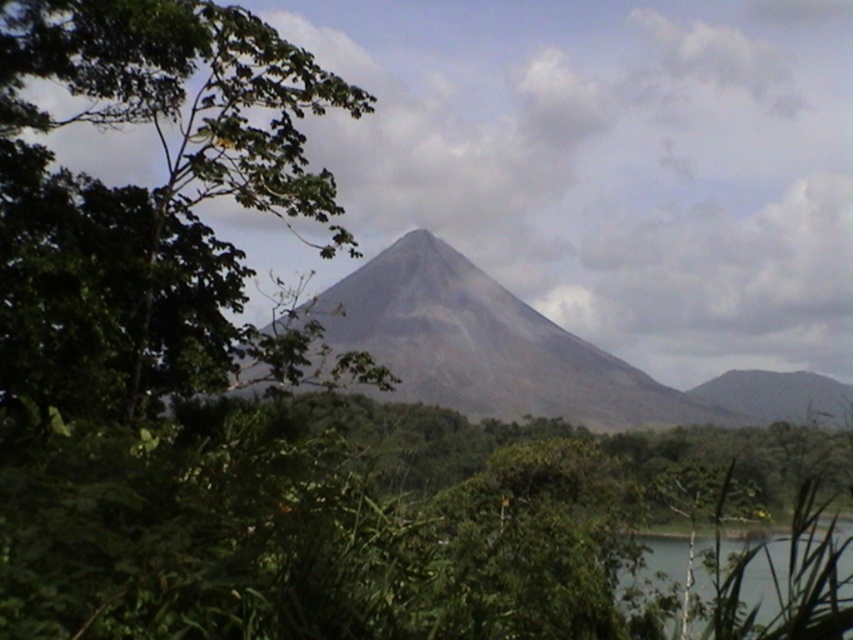
Question: Among these points, which one is farthest from the camera?

Choices:
 (A) (1, 156)
 (B) (683, 547)
 (C) (436, 248)

Answer: (C)

Question: Which object appears farthest from the camera in this image?

Choices:
 (A) gray volcanic rock mountain at center
 (B) transparent water at lower right

Answer: (A)

Question: Can you confirm if green leafy tree at center is positioned to the left of gray volcanic rock mountain at center?

Choices:
 (A) no
 (B) yes

Answer: (B)

Question: Is green leafy tree at center bigger than gray volcanic rock mountain at center?

Choices:
 (A) yes
 (B) no

Answer: (B)

Question: Does green leafy tree at center appear on the right side of transparent water at lower right?

Choices:
 (A) yes
 (B) no

Answer: (B)

Question: Which object appears closest to the camera in this image?

Choices:
 (A) transparent water at lower right
 (B) green leafy tree at center
 (C) gray volcanic rock mountain at center

Answer: (A)